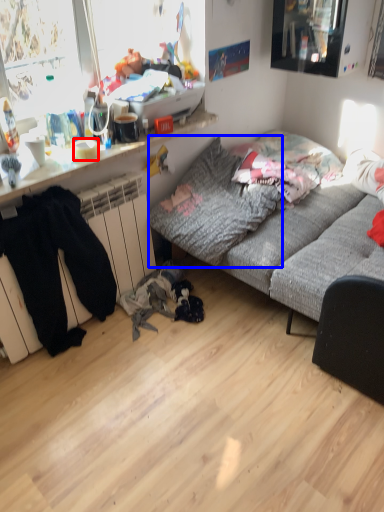
Question: Among these objects, which one is nearest to the camera, bowl (highlighted by a red box) or pillow (highlighted by a blue box)?

Choices:
 (A) bowl
 (B) pillow

Answer: (B)